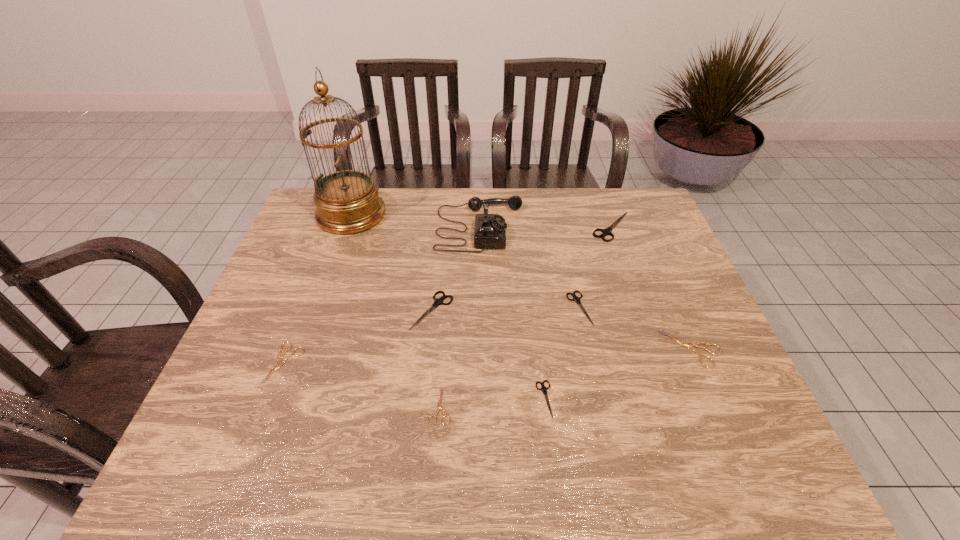
This screenshot has height=540, width=960. I want to click on vacant area that lies between the sixth shortest object and the third black shears from left to right, so click(x=506, y=309).

Identify the location of empty space between the sixth shortest shears and the shortest shears. (436, 358).

Image resolution: width=960 pixels, height=540 pixels. What are the coordinates of `vacant point located between the birdcage and the second smallest beige shears` in the screenshot? It's located at (318, 289).

What are the coordinates of `vacant space that is in between the biggest beige shears and the tallest object` in the screenshot? It's located at (521, 281).

You are a GUI agent. You are given a task and a screenshot of the screen. Output one action in this format:
    pyautogui.click(x=<x>, y=<y>)
    Task: Click on the vacant area that lies between the telephone and the rightmost beige shears
    Image resolution: width=960 pixels, height=540 pixels.
    Given the screenshot: What is the action you would take?
    pyautogui.click(x=586, y=288)

Locate an element on the screen. The width and height of the screenshot is (960, 540). free spot between the leftmost shears and the rightmost black shears is located at coordinates (448, 295).

Locate which object is the second closest to the tallest object. Please provide its 2D coordinates. Your answer should be formatted as a tuple, i.e. [(x, y)], where the tuple contains the x and y coordinates of a point satisfying the conditions above.

[(439, 301)]

Locate which object ranks third in proximity to the tallest shears. Please provide its 2D coordinates. Your answer should be formatted as a tuple, i.e. [(x, y)], where the tuple contains the x and y coordinates of a point satisfying the conditions above.

[(688, 345)]

Select which shears appears as the second closest to the fourth shears from right to left. Please provide its 2D coordinates. Your answer should be formatted as a tuple, i.e. [(x, y)], where the tuple contains the x and y coordinates of a point satisfying the conditions above.

[(439, 406)]

The width and height of the screenshot is (960, 540). I want to click on shears identified as the seventh closest to the telephone, so click(x=439, y=406).